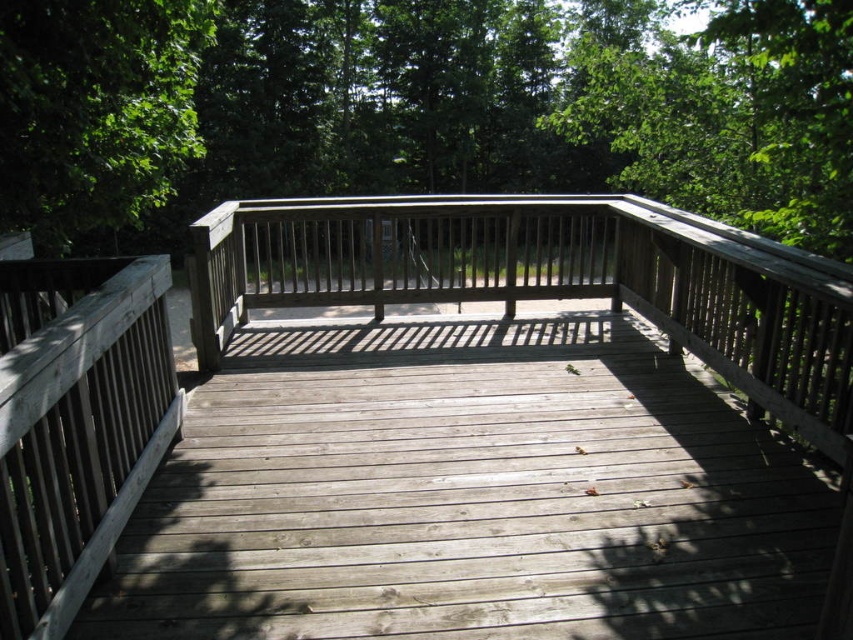
Does green matte fence at upper center come in front of green leafy tree at upper left?

Yes.

Does point (119, 230) lie behind point (213, 8)?

That is True.

Identify the location of green matte fence at upper center. The width and height of the screenshot is (853, 640). (419, 108).

Does weathered wood bench at center have a lesser height compared to green leafy tree at upper left?

Incorrect, weathered wood bench at center's height does not fall short of green leafy tree at upper left's.

Is point (403, 268) closer to viewer compared to point (48, 188)?

No, it is not.

Where is `weathered wood bench at center`? The width and height of the screenshot is (853, 640). weathered wood bench at center is located at coordinates (548, 280).

Can you confirm if weathered wood porch at center is shorter than weathered wood bench at center?

In fact, weathered wood porch at center may be taller than weathered wood bench at center.

Is weathered wood porch at center thinner than weathered wood bench at center?

Indeed, weathered wood porch at center has a lesser width compared to weathered wood bench at center.

Does point (845, 314) come behind point (647, 200)?

No, it is not.

This screenshot has height=640, width=853. I want to click on weathered wood porch at center, so click(547, 280).